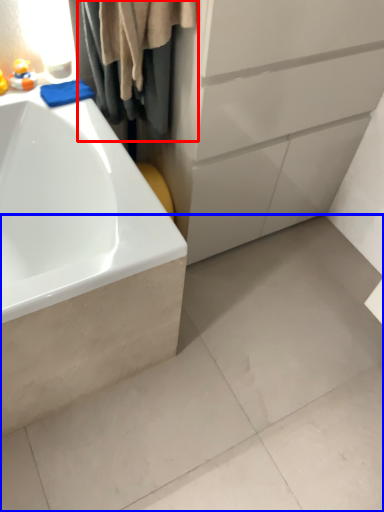
Question: Which of the following is the closest to the observer, shower curtain (highlighted by a red box) or concrete (highlighted by a blue box)?

Choices:
 (A) shower curtain
 (B) concrete

Answer: (A)